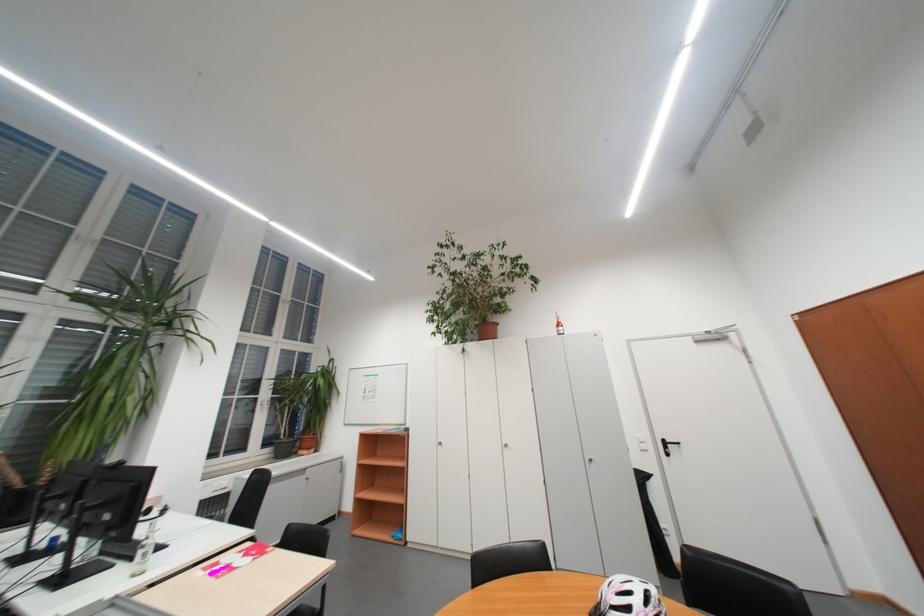
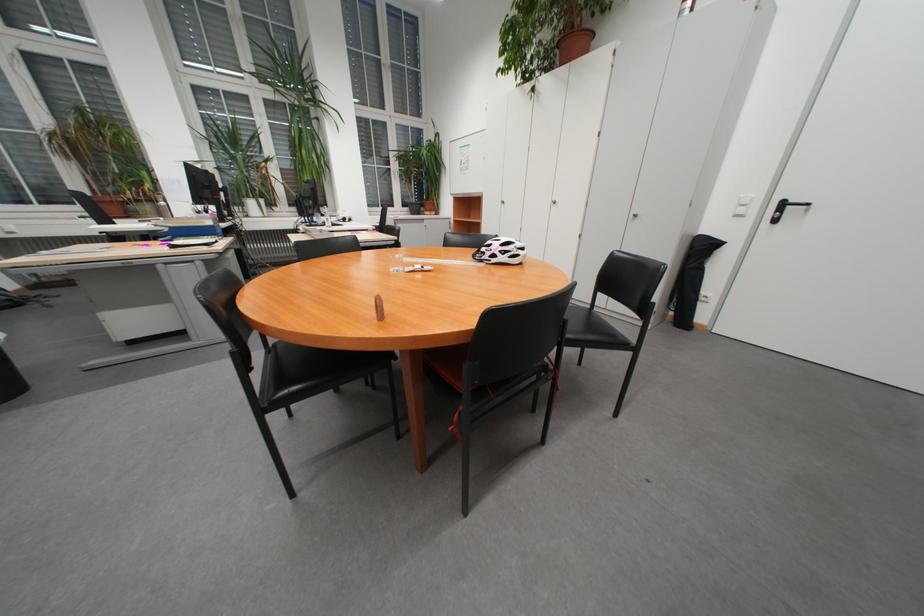
The point at (640, 610) is marked in the first image. Where is the corresponding point in the second image?

(502, 246)